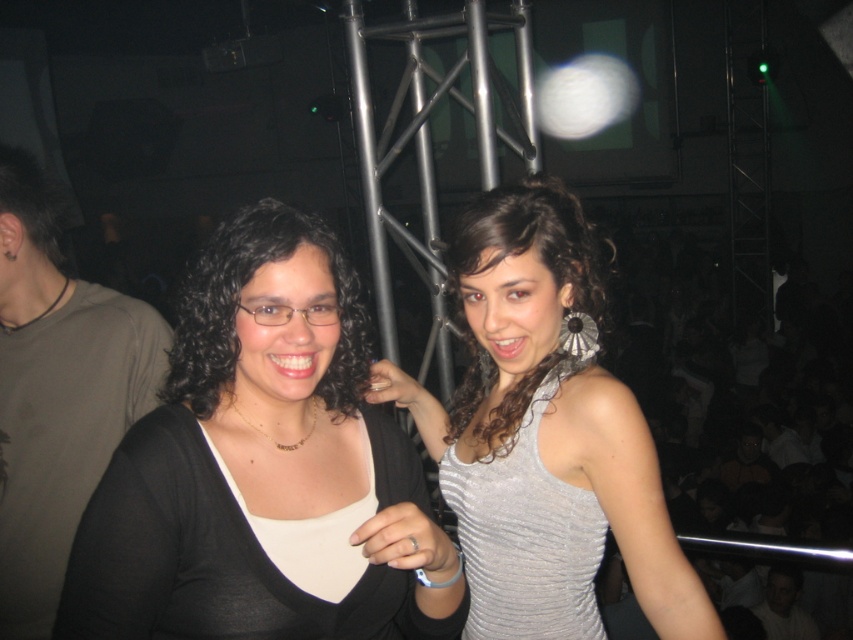
Question: Among these points, which one is nearest to the camera?

Choices:
 (A) (49, 464)
 (B) (339, 397)
 (C) (216, 243)
 (D) (550, 209)

Answer: (C)

Question: Does shiny silver dress at center appear under matte black hair at center?

Choices:
 (A) no
 (B) yes

Answer: (B)

Question: Which of the following is the closest to the observer?

Choices:
 (A) matte black hair at center
 (B) shiny silver dress at center

Answer: (A)

Question: Can you confirm if matte black shirt at center is positioned below matte black hair at center?

Choices:
 (A) yes
 (B) no

Answer: (A)

Question: Is matte black shirt at left further to the viewer compared to matte black hair at center?

Choices:
 (A) no
 (B) yes

Answer: (B)

Question: Which object is positioned closest to the matte black shirt at left?

Choices:
 (A) shiny silver dress at center
 (B) matte black shirt at center

Answer: (B)